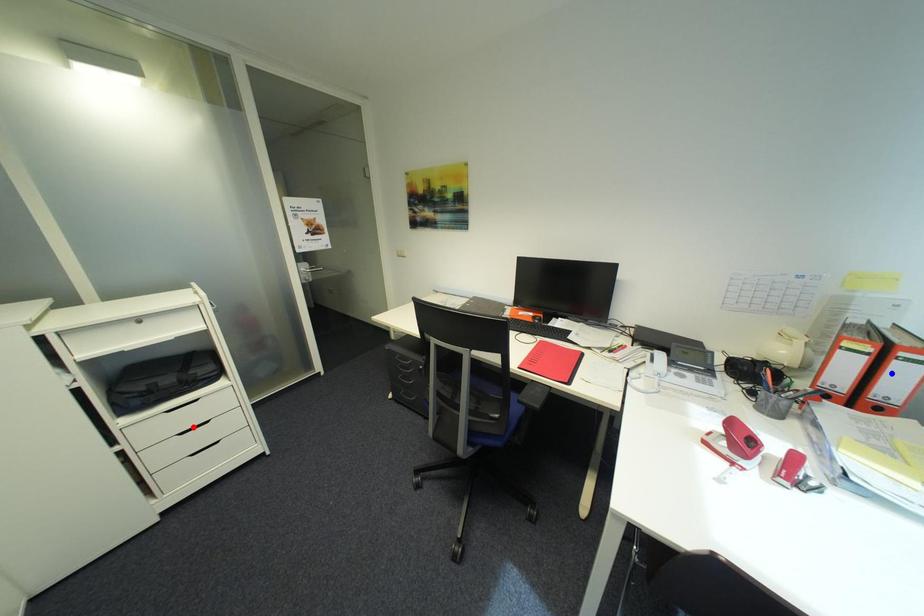
Question: Which of the two points in the image is closer to the camera?

Choices:
 (A) Blue point is closer.
 (B) Red point is closer.

Answer: (A)